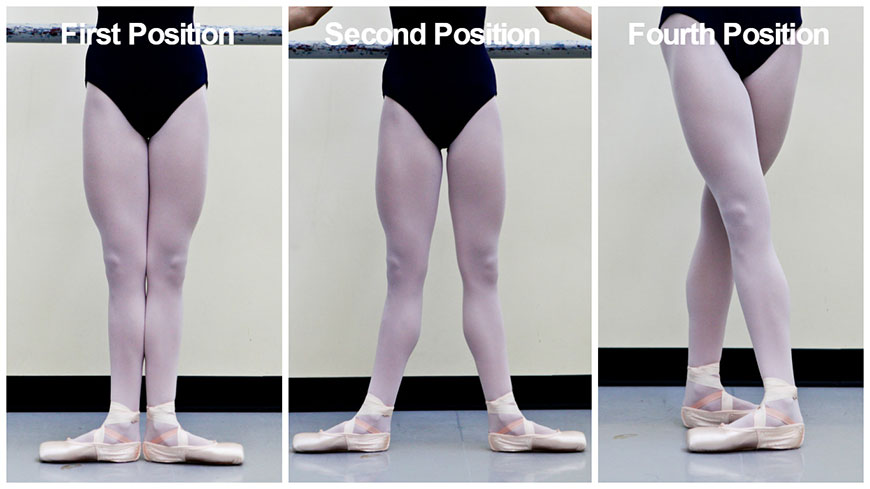
Find the location of `beige wall`. beige wall is located at coordinates (x=59, y=272), (x=198, y=269), (x=308, y=268), (x=551, y=220), (x=645, y=190), (x=818, y=157).